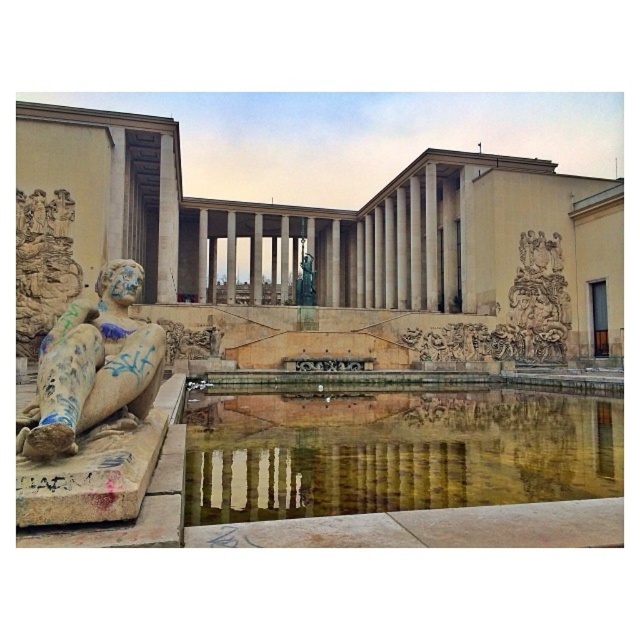
In the scene shown: Who is taller, stone statue at left or green polished stone statue at center?

With more height is green polished stone statue at center.

Is stone statue at left wider than green polished stone statue at center?

Indeed, stone statue at left has a greater width compared to green polished stone statue at center.

You are a GUI agent. You are given a task and a screenshot of the screen. Output one action in this format:
    pyautogui.click(x=<x>, y=<y>)
    Task: Click on the stone statue at left
    
    Given the screenshot: What is the action you would take?
    pyautogui.click(x=93, y=365)

Can you confirm if reflective stone pool at center is positioned above stone statue at left?

No, reflective stone pool at center is not above stone statue at left.

Who is more distant from viewer, (x=305, y=444) or (x=115, y=275)?

Point (x=305, y=444)

This screenshot has width=640, height=640. I want to click on reflective stone pool at center, so click(394, 451).

What do you see at coordinates (394, 451) in the screenshot? The width and height of the screenshot is (640, 640). I see `reflective stone pool at center` at bounding box center [394, 451].

This screenshot has width=640, height=640. What are the coordinates of `reflective stone pool at center` in the screenshot? It's located at (394, 451).